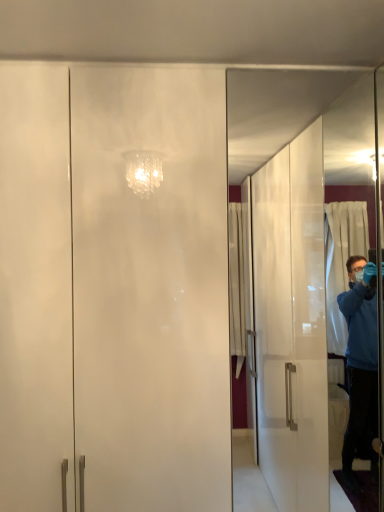
Question: Considering the relative sizes of frosted glass cabinet at center, the first screen door positioned from the front, and transparent glass screen door at right, arranged as the second screen door when viewed from the front, in the image provided, is frosted glass cabinet at center, the first screen door positioned from the front, smaller than transparent glass screen door at right, arranged as the second screen door when viewed from the front,?

Choices:
 (A) no
 (B) yes

Answer: (A)

Question: Is frosted glass cabinet at center, the 1th screen door viewed from the left, oriented towards transparent glass screen door at right, the first screen door in the back-to-front sequence?

Choices:
 (A) yes
 (B) no

Answer: (B)

Question: Does frosted glass cabinet at center, the first screen door positioned from the front, appear on the left side of transparent glass screen door at right, placed as the first screen door when sorted from right to left?

Choices:
 (A) no
 (B) yes

Answer: (B)

Question: From a real-world perspective, is frosted glass cabinet at center, the 1th screen door viewed from the left, below transparent glass screen door at right, which is the second screen door from left to right?

Choices:
 (A) no
 (B) yes

Answer: (B)

Question: Does frosted glass cabinet at center, which is the second screen door from right to left, have a greater height compared to transparent glass screen door at right, the first screen door in the back-to-front sequence?

Choices:
 (A) yes
 (B) no

Answer: (A)

Question: Does frosted glass cabinet at center, the second screen door when ordered from back to front, appear on the right side of transparent glass screen door at right, which is the second screen door from left to right?

Choices:
 (A) yes
 (B) no

Answer: (B)

Question: From a real-world perspective, is transparent glass screen door at right, which is the second screen door from left to right, positioned under frosted glass cabinet at center, which is the second screen door from right to left, based on gravity?

Choices:
 (A) yes
 (B) no

Answer: (B)

Question: Is transparent glass screen door at right, which is the second screen door from left to right, outside of frosted glass cabinet at center, the second screen door when ordered from back to front?

Choices:
 (A) no
 (B) yes

Answer: (B)

Question: Can you confirm if transparent glass screen door at right, arranged as the second screen door when viewed from the front, is smaller than frosted glass cabinet at center, the first screen door positioned from the front?

Choices:
 (A) no
 (B) yes

Answer: (B)

Question: Is frosted glass cabinet at center, which is the second screen door from right to left, located within transparent glass screen door at right, placed as the first screen door when sorted from right to left?

Choices:
 (A) yes
 (B) no

Answer: (B)

Question: Does transparent glass screen door at right, arranged as the second screen door when viewed from the front, lie behind frosted glass cabinet at center, the first screen door positioned from the front?

Choices:
 (A) yes
 (B) no

Answer: (A)

Question: Is transparent glass screen door at right, arranged as the second screen door when viewed from the front, oriented away from frosted glass cabinet at center, the first screen door positioned from the front?

Choices:
 (A) no
 (B) yes

Answer: (A)

Question: Looking at their shapes, would you say transparent glass screen door at right, arranged as the second screen door when viewed from the front, is wider or thinner than frosted glass cabinet at center, the 1th screen door viewed from the left?

Choices:
 (A) wide
 (B) thin

Answer: (B)